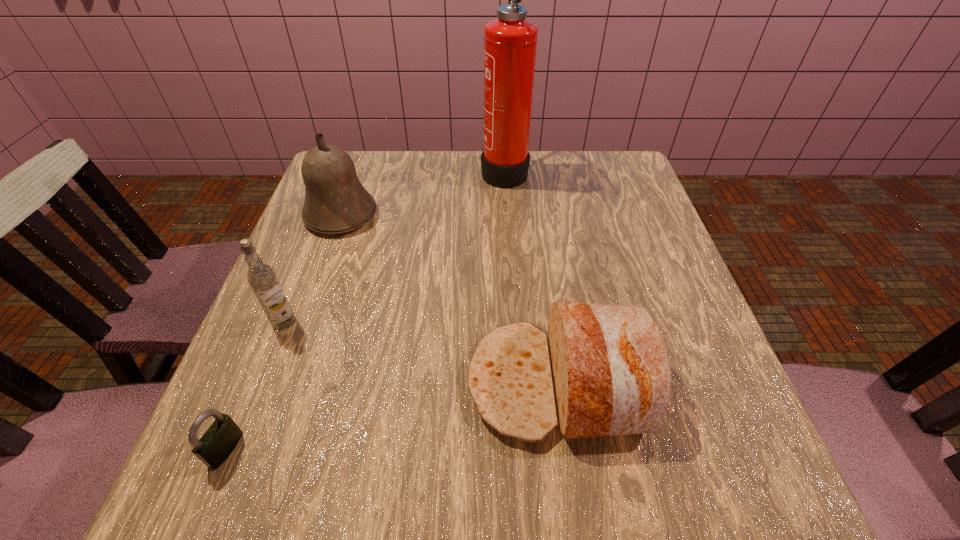
This screenshot has width=960, height=540. I want to click on object that stands as the third closest to the farthest object, so point(262,278).

Locate which object is the closest to the fourth nearest object. Please provide its 2D coordinates. Your answer should be formatted as a tuple, i.e. [(x, y)], where the tuple contains the x and y coordinates of a point satisfying the conditions above.

[(262, 278)]

Where is `vacant space that satisfies the following two spatial constraints: 1. on the back side of the fourth nearest object; 2. on the left side of the shortest object`? Image resolution: width=960 pixels, height=540 pixels. vacant space that satisfies the following two spatial constraints: 1. on the back side of the fourth nearest object; 2. on the left side of the shortest object is located at coordinates (321, 215).

Identify the location of blank area in the image that satisfies the following two spatial constraints: 1. on the front-facing side of the fire extinguisher; 2. on the label of the vodka. click(515, 322).